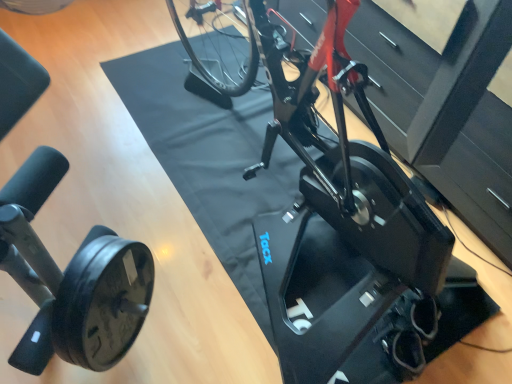
Question: From the image's perspective, is black rubber stationary bicycle at lower left, marked as the second stationary bicycle in a back-to-front arrangement, above black rubber wheel at lower left?

Choices:
 (A) yes
 (B) no

Answer: (A)

Question: From a real-world perspective, does black rubber stationary bicycle at lower left, which is the first stationary bicycle in left-to-right order, stand above black rubber wheel at lower left?

Choices:
 (A) no
 (B) yes

Answer: (A)

Question: Considering the relative sizes of black rubber stationary bicycle at lower left, which is the first stationary bicycle in left-to-right order, and black rubber wheel at lower left in the image provided, is black rubber stationary bicycle at lower left, which is the first stationary bicycle in left-to-right order, taller than black rubber wheel at lower left?

Choices:
 (A) yes
 (B) no

Answer: (B)

Question: Is black rubber stationary bicycle at lower left, marked as the second stationary bicycle in a back-to-front arrangement, turned away from black rubber wheel at lower left?

Choices:
 (A) yes
 (B) no

Answer: (A)

Question: Is black rubber stationary bicycle at lower left, acting as the 1th stationary bicycle starting from the front, wider than black rubber wheel at lower left?

Choices:
 (A) no
 (B) yes

Answer: (B)

Question: Does black rubber stationary bicycle at lower left, acting as the 1th stationary bicycle starting from the front, have a lesser height compared to black rubber wheel at lower left?

Choices:
 (A) yes
 (B) no

Answer: (A)

Question: Does black rubber stationary bicycle at lower left, the 2th stationary bicycle when ordered from right to left, have a lesser width compared to black matte stationary bicycle at center, which ranks as the second stationary bicycle in left-to-right order?

Choices:
 (A) no
 (B) yes

Answer: (B)

Question: From the image's perspective, is black rubber stationary bicycle at lower left, the 2th stationary bicycle when ordered from right to left, over black matte stationary bicycle at center, which is the first stationary bicycle in back-to-front order?

Choices:
 (A) yes
 (B) no

Answer: (B)

Question: From a real-world perspective, is black rubber stationary bicycle at lower left, acting as the 1th stationary bicycle starting from the front, beneath black matte stationary bicycle at center, the 2th stationary bicycle viewed from the front?

Choices:
 (A) no
 (B) yes

Answer: (A)

Question: Considering the relative sizes of black rubber stationary bicycle at lower left, marked as the second stationary bicycle in a back-to-front arrangement, and black matte stationary bicycle at center, which ranks as the second stationary bicycle in left-to-right order, in the image provided, is black rubber stationary bicycle at lower left, marked as the second stationary bicycle in a back-to-front arrangement, smaller than black matte stationary bicycle at center, which ranks as the second stationary bicycle in left-to-right order,?

Choices:
 (A) yes
 (B) no

Answer: (A)

Question: From the image's perspective, is black rubber stationary bicycle at lower left, acting as the 1th stationary bicycle starting from the front, under black matte stationary bicycle at center, which ranks as the second stationary bicycle in left-to-right order?

Choices:
 (A) no
 (B) yes

Answer: (B)

Question: Is black rubber stationary bicycle at lower left, which is the first stationary bicycle in left-to-right order, taller than black matte stationary bicycle at center, marked as the 1th stationary bicycle in a right-to-left arrangement?

Choices:
 (A) yes
 (B) no

Answer: (A)

Question: Is black matte stationary bicycle at center, marked as the 1th stationary bicycle in a right-to-left arrangement, next to black rubber stationary bicycle at lower left, marked as the second stationary bicycle in a back-to-front arrangement?

Choices:
 (A) no
 (B) yes

Answer: (A)